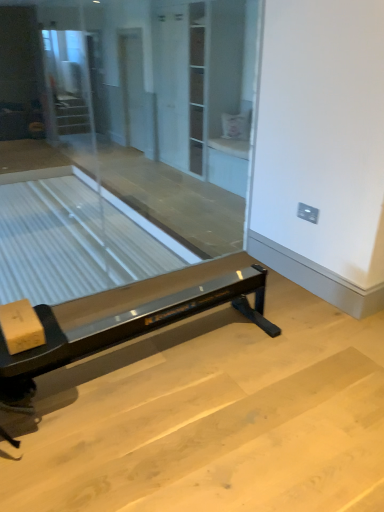
Question: From the image's perspective, is clear glass table at left over black glossy rowing machine at center?

Choices:
 (A) yes
 (B) no

Answer: (A)

Question: Does clear glass table at left touch black glossy rowing machine at center?

Choices:
 (A) yes
 (B) no

Answer: (B)

Question: Is clear glass table at left wider than black glossy rowing machine at center?

Choices:
 (A) no
 (B) yes

Answer: (B)

Question: Is clear glass table at left smaller than black glossy rowing machine at center?

Choices:
 (A) yes
 (B) no

Answer: (B)

Question: Does clear glass table at left have a greater height compared to black glossy rowing machine at center?

Choices:
 (A) no
 (B) yes

Answer: (B)

Question: Are clear glass table at left and black glossy rowing machine at center located far from each other?

Choices:
 (A) no
 (B) yes

Answer: (B)

Question: Does black glossy rowing machine at center appear on the right side of clear glass table at left?

Choices:
 (A) yes
 (B) no

Answer: (A)

Question: From the image's perspective, would you say black glossy rowing machine at center is positioned over clear glass table at left?

Choices:
 (A) yes
 (B) no

Answer: (B)

Question: Is clear glass table at left inside black glossy rowing machine at center?

Choices:
 (A) yes
 (B) no

Answer: (B)

Question: Is the depth of black glossy rowing machine at center less than that of clear glass table at left?

Choices:
 (A) no
 (B) yes

Answer: (B)

Question: Does black glossy rowing machine at center lie behind clear glass table at left?

Choices:
 (A) yes
 (B) no

Answer: (B)

Question: Does black glossy rowing machine at center turn towards clear glass table at left?

Choices:
 (A) yes
 (B) no

Answer: (B)

Question: Is transparent glass screen door at center taller than black glossy rowing machine at center?

Choices:
 (A) yes
 (B) no

Answer: (A)